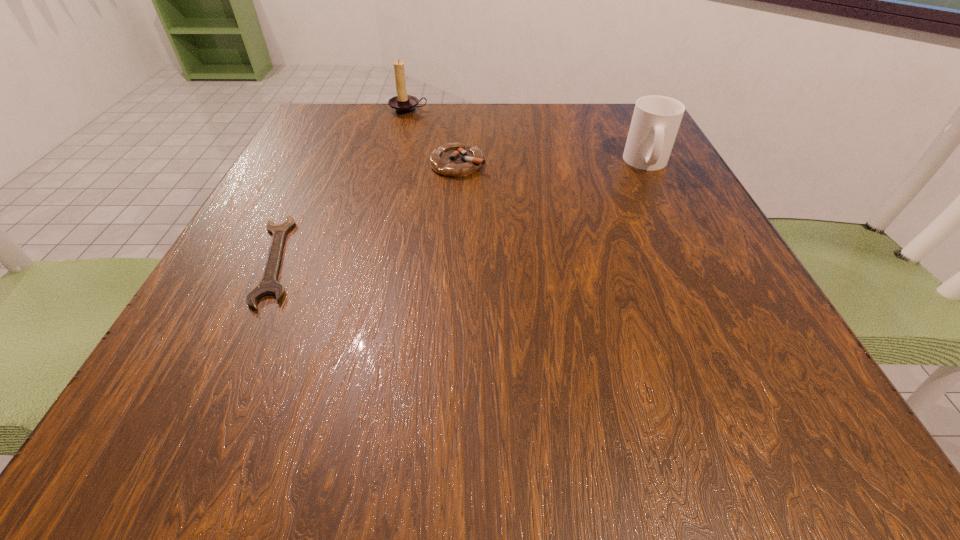
You are a GUI agent. You are given a task and a screenshot of the screen. Output one action in this format:
    pyautogui.click(x=<x>, y=<y>)
    Task: Click on the vacant space situated 0.240m on the right of the leftmost object
    This screenshot has height=540, width=960.
    Given the screenshot: What is the action you would take?
    pyautogui.click(x=451, y=260)

Identify the location of candle holder that is at the far edge. The image size is (960, 540). (403, 104).

Find the location of a particular element. mug that is at the far edge is located at coordinates click(x=656, y=119).

Locate an element on the screen. The height and width of the screenshot is (540, 960). ashtray that is at the far edge is located at coordinates [455, 160].

Identify the location of object situated at the left edge. The image size is (960, 540). (268, 285).

What are the coordinates of `object present at the right edge` in the screenshot? It's located at (656, 119).

This screenshot has width=960, height=540. Find the location of `object that is at the far right corner`. object that is at the far right corner is located at coordinates (656, 119).

Find the location of a particular element. This screenshot has height=540, width=960. vacant space at the far edge of the desktop is located at coordinates (411, 142).

In the image, there is a desktop. Where is `free region at the near edge`? The image size is (960, 540). free region at the near edge is located at coordinates click(x=512, y=444).

In the image, there is a desktop. Identify the location of vacant space at the left edge. This screenshot has height=540, width=960. (251, 259).